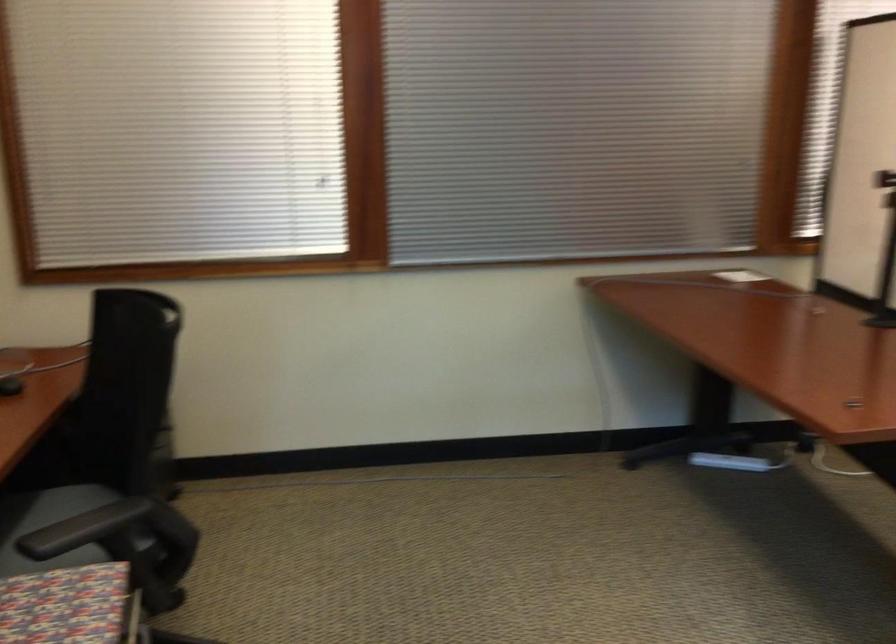
Find where to sit the chair sitting surface. Please return your answer as a coordinate pair (x, y).

(47, 525)